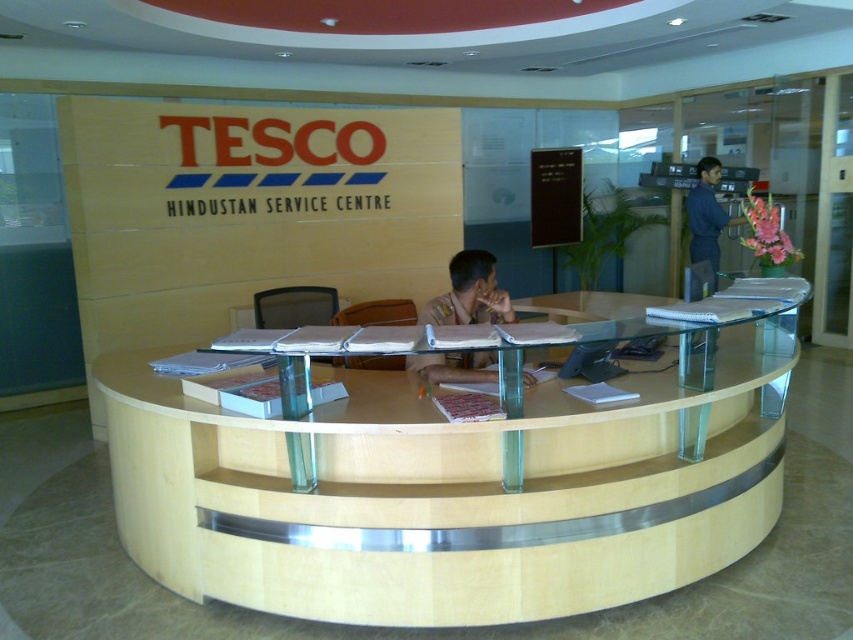
Question: Which point is closer to the camera taking this photo?

Choices:
 (A) (717, 214)
 (B) (241, 445)
 (C) (474, 380)

Answer: (B)

Question: Which of the following is the closest to the observer?

Choices:
 (A) (503, 310)
 (B) (773, 420)
 (C) (688, 204)

Answer: (A)

Question: Is brown uniform at center above blue uniform shirt at right?

Choices:
 (A) no
 (B) yes

Answer: (A)

Question: From the image, what is the correct spatial relationship of light wood/woodenobject at center in relation to blue uniform shirt at right?

Choices:
 (A) above
 (B) below

Answer: (B)

Question: Which point is farther to the camera?

Choices:
 (A) (183, 524)
 (B) (689, 228)

Answer: (B)

Question: Can you confirm if light wood/woodenobject at center is positioned above brown uniform at center?

Choices:
 (A) no
 (B) yes

Answer: (A)